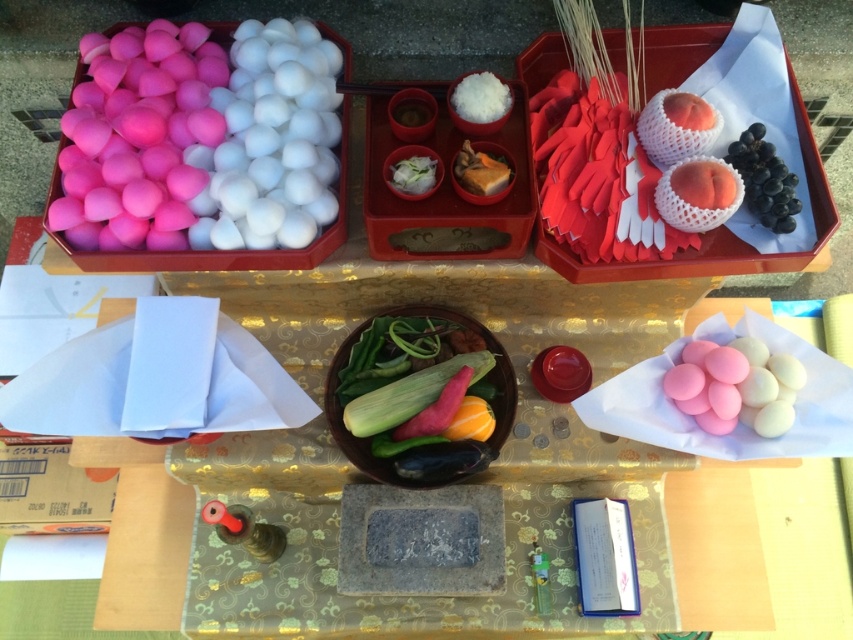
Question: Considering the relative positions of pink matte candy at lower right and white fluffy rice at upper center in the image provided, where is pink matte candy at lower right located with respect to white fluffy rice at upper center?

Choices:
 (A) above
 (B) below

Answer: (B)

Question: Is pink matte ping pong balls at left positioned before green matte cucumber at center?

Choices:
 (A) no
 (B) yes

Answer: (B)

Question: Which of the following is the closest to the observer?

Choices:
 (A) (791, 228)
 (B) (454, 161)
 (C) (318, 212)

Answer: (B)

Question: Which object is closer to the camera taking this photo?

Choices:
 (A) black glossy grapes at upper right
 (B) pink matte ping pong balls at upper left
 (C) green matte cucumber at center
 (D) white glossy bowl at center

Answer: (B)

Question: Based on their relative distances, which object is nearer to the black glossy grapes at upper right?

Choices:
 (A) pink matte candy at lower right
 (B) pink matte ping pong balls at upper left
 (C) green matte cucumber at center

Answer: (A)

Question: Does slightly browned bread at center lie in front of white glossy bowl at center?

Choices:
 (A) no
 (B) yes

Answer: (B)